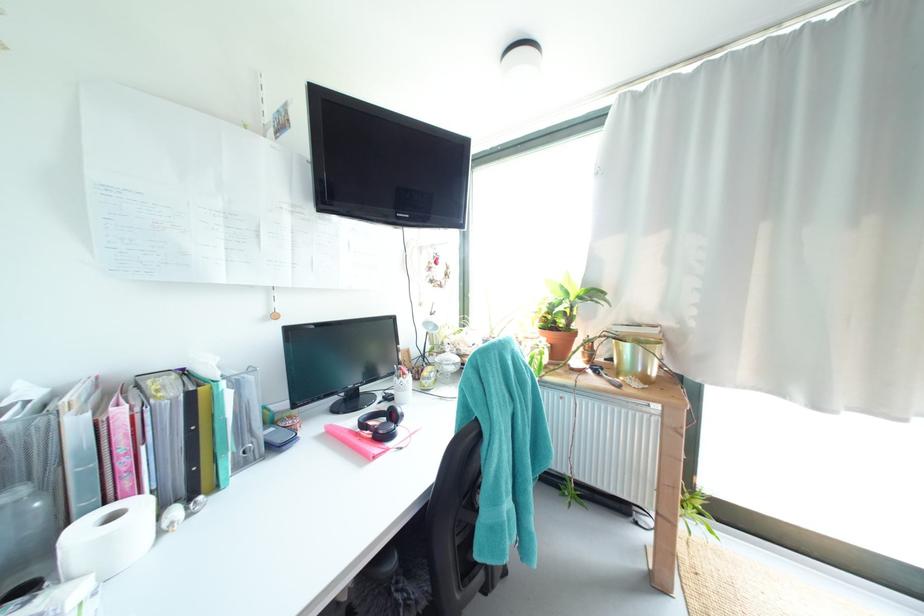
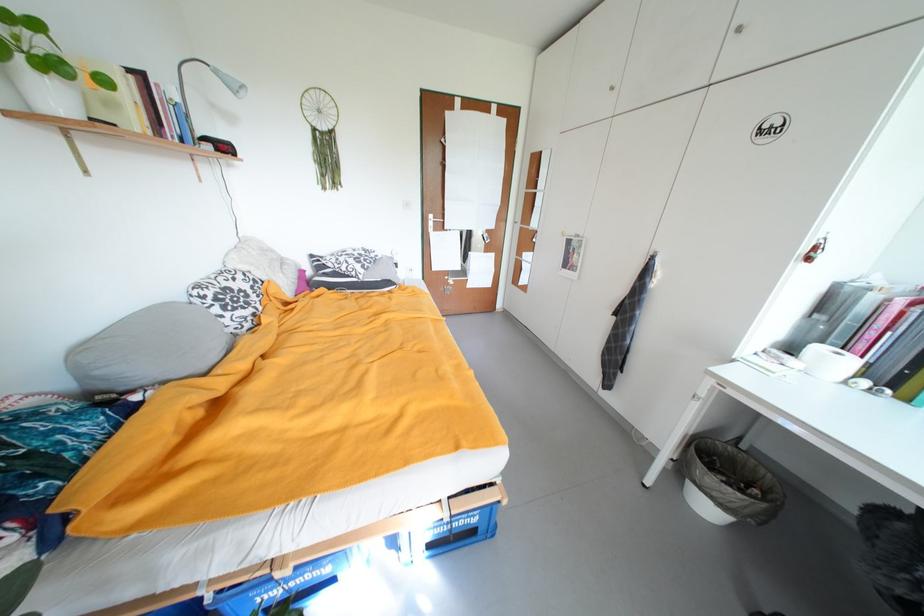
Locate, in the second image, the point that corresponds to the point at 120,517 in the first image.

(845, 355)